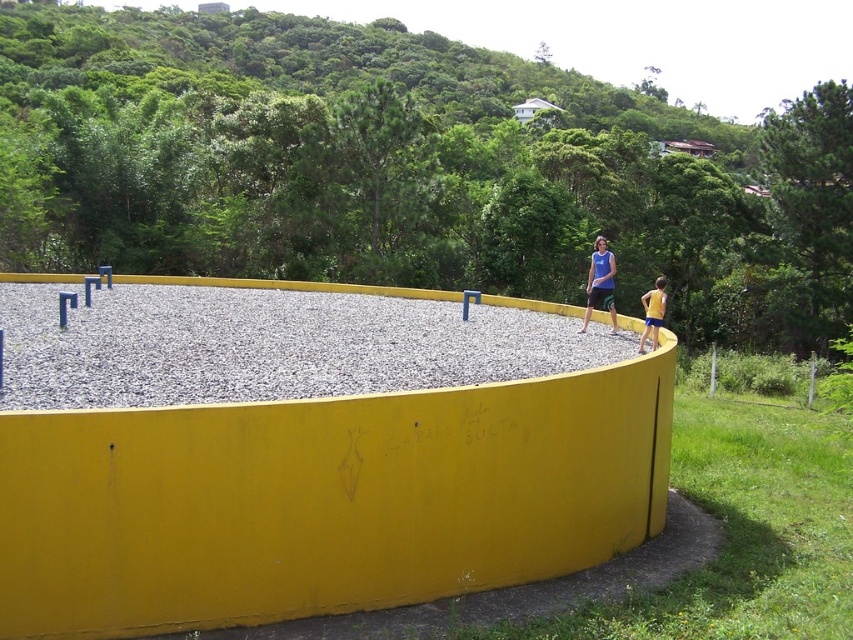
Question: Which is farther from the blue fabric shirt at center?

Choices:
 (A) gray gravel at center
 (B) yellow painted concrete barrier at center
 (C) yellow fabric shorts at right

Answer: (B)

Question: Which point is closer to the camera taking this photo?

Choices:
 (A) (556, 316)
 (B) (590, 298)
 (C) (642, 300)
 (D) (618, 516)

Answer: (D)

Question: Does blue fabric shirt at center appear on the right side of yellow fabric shorts at right?

Choices:
 (A) yes
 (B) no

Answer: (B)

Question: Can you confirm if blue fabric shirt at center is positioned to the right of yellow fabric shorts at right?

Choices:
 (A) yes
 (B) no

Answer: (B)

Question: From the image, what is the correct spatial relationship of yellow painted concrete barrier at center in relation to gray gravel at center?

Choices:
 (A) above
 (B) below

Answer: (B)

Question: Among these points, which one is farthest from the camera?

Choices:
 (A) (277, 365)
 (B) (468, 532)
 (C) (590, 273)

Answer: (C)